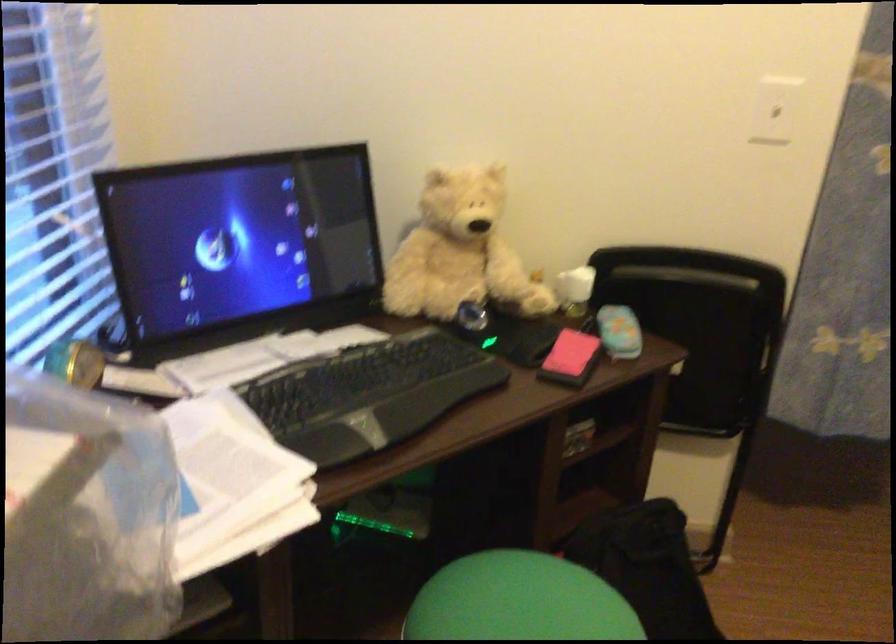
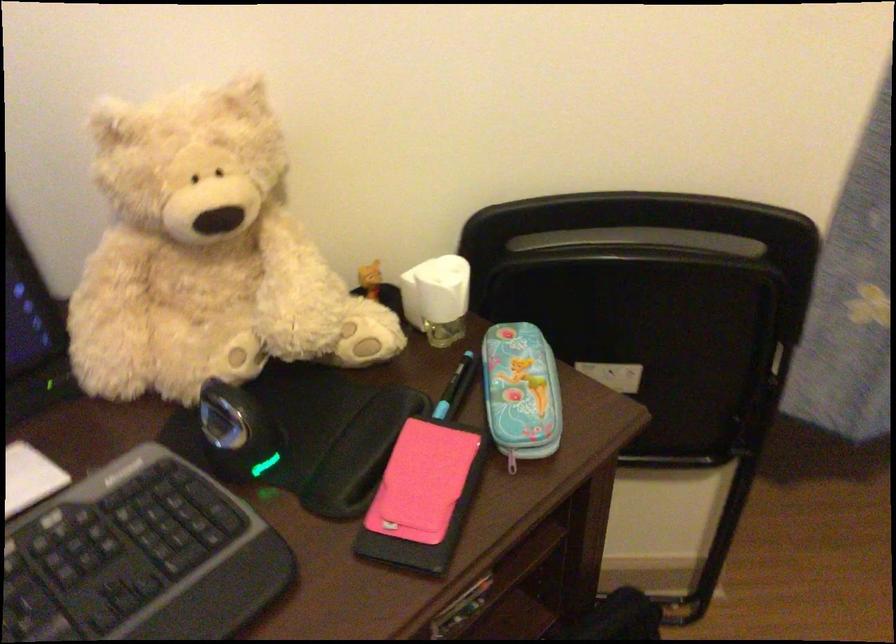
The point at (578, 279) is marked in the first image. Where is the corresponding point in the second image?

(437, 298)